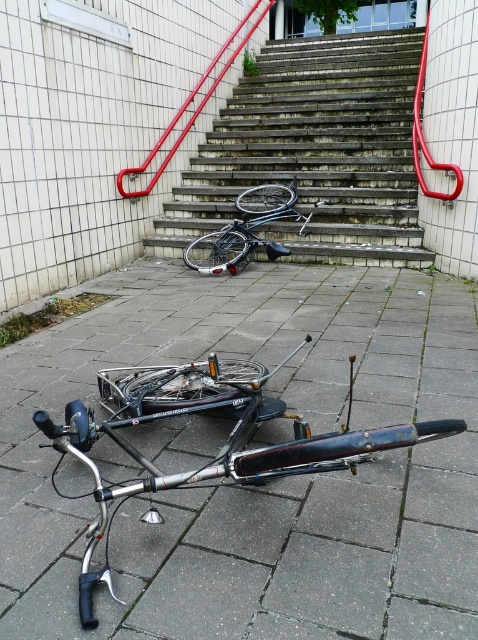
Question: Is concrete stairs at center to the right of red metal handrail at upper center from the viewer's perspective?

Choices:
 (A) yes
 (B) no

Answer: (A)

Question: Considering the real-world distances, which object is farthest from the red metal handrail at upper center?

Choices:
 (A) shiny metallic bicycle at center
 (B) concrete stairs at center
 (C) smooth concrete pavement at center

Answer: (C)

Question: Can you confirm if smooth concrete pavement at center is bigger than red metal handrail at upper center?

Choices:
 (A) no
 (B) yes

Answer: (B)

Question: Estimate the real-world distances between objects in this image. Which object is closer to the concrete stairs at center?

Choices:
 (A) red metal handrail at upper center
 (B) smooth concrete pavement at center

Answer: (A)

Question: Which point is closer to the camera?

Choices:
 (A) concrete stairs at center
 (B) red metal handrail at upper center
 (C) shiny metallic bicycle at center

Answer: (A)

Question: Can you confirm if smooth concrete pavement at center is bigger than shiny metallic bicycle at center?

Choices:
 (A) no
 (B) yes

Answer: (B)